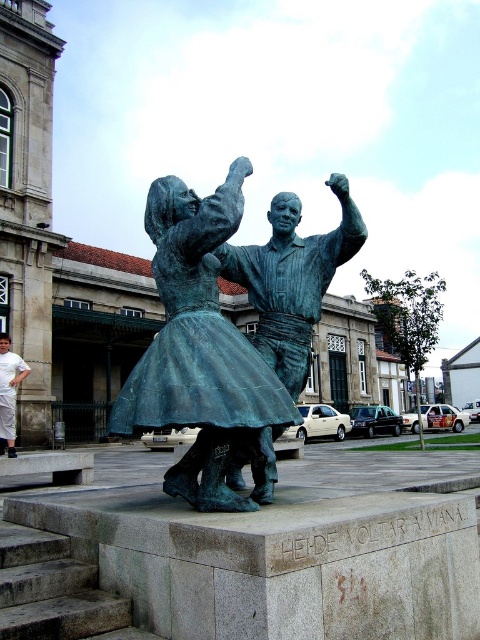
You are standing at the bottom of the gray stone stairs at lower left and want to approach the bronze statue at center. In which direction should you move to reach the statue?

You should move to the right to reach the bronze statue at center since it is located to the left of the gray stone stairs at lower left, meaning the statue is positioned to the right from your perspective at the base of the stairs.

You are an artist planning to sketch the scene in front of you. You notice the bronze statue at center and the white cotton pants at lower left. Which object should you draw first if you want to capture the wider one first?

The white cotton pants at lower left should be drawn first since it has a greater width than the bronze statue at center, as stated in the objects description.

You are a delivery person carrying a heavy box and need to climb the gray stone stairs at lower left and the white cotton pants at lower left. Which one is easier to climb?

The gray stone stairs at lower left has a lesser height compared to white cotton pants at lower left, so it is easier to climb the gray stone stairs at lower left.